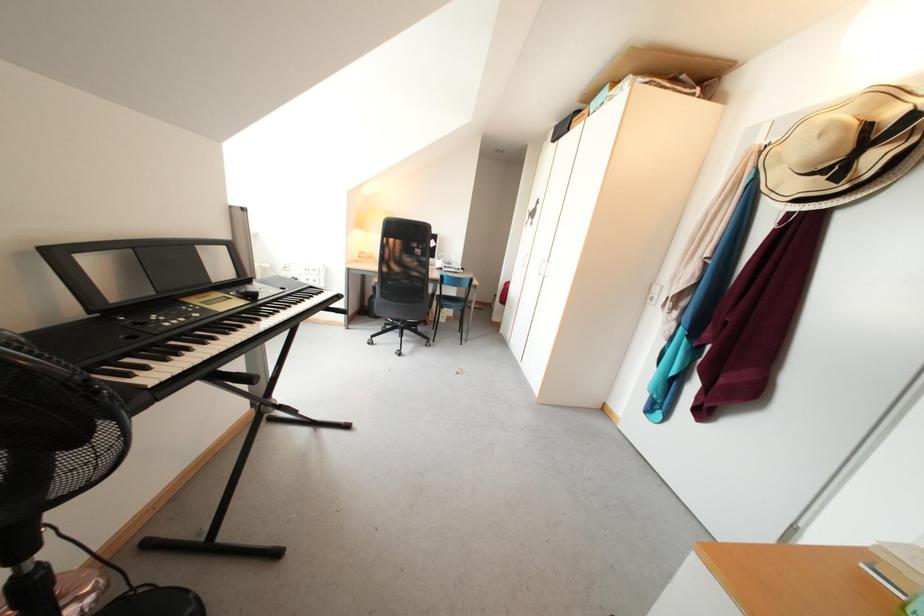
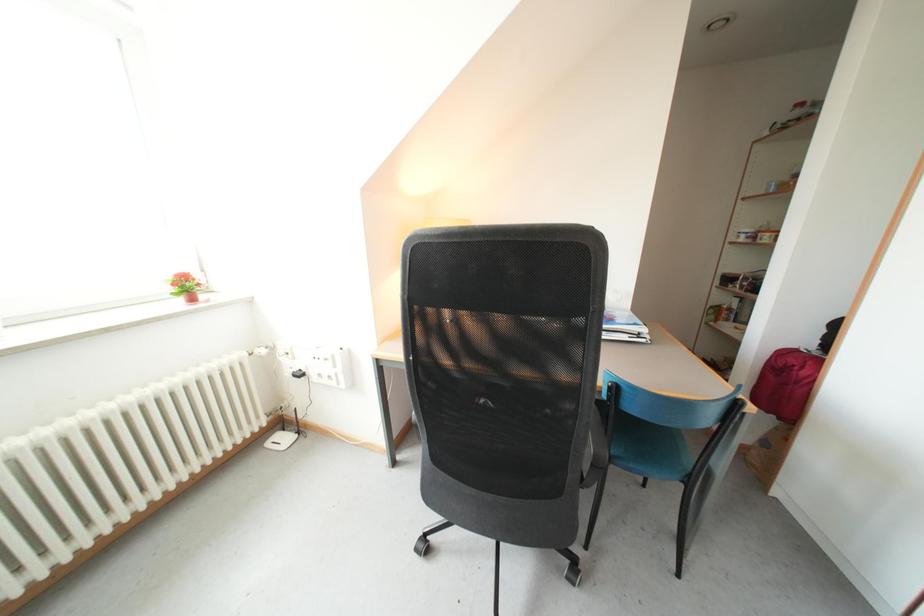
Question: The images are taken continuously from a first-person perspective. In which direction are you moving?

Choices:
 (A) Left
 (B) Right
 (C) Forward
 (D) Backward

Answer: (C)